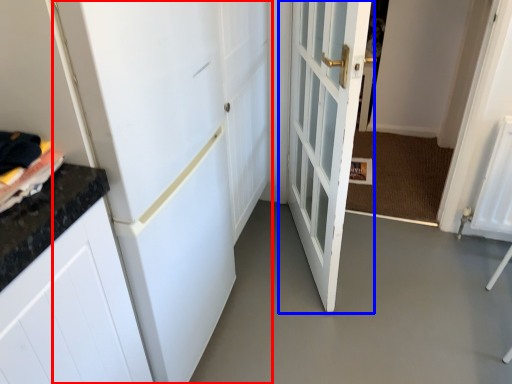
Question: Which object appears closest to the camera in this image, door (highlighted by a red box) or door (highlighted by a blue box)?

Choices:
 (A) door
 (B) door

Answer: (A)